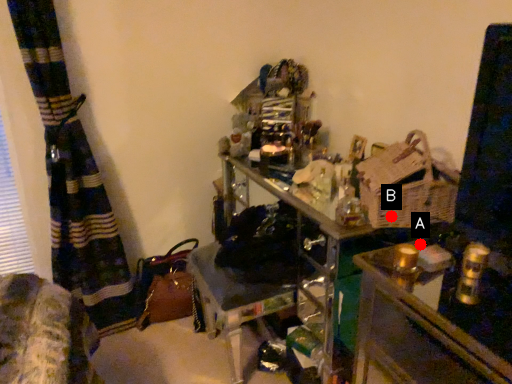
Question: Two points are circled on the image, labeled by A and B beside each circle. Which point is farther to the camera?

Choices:
 (A) A is further
 (B) B is further

Answer: (B)